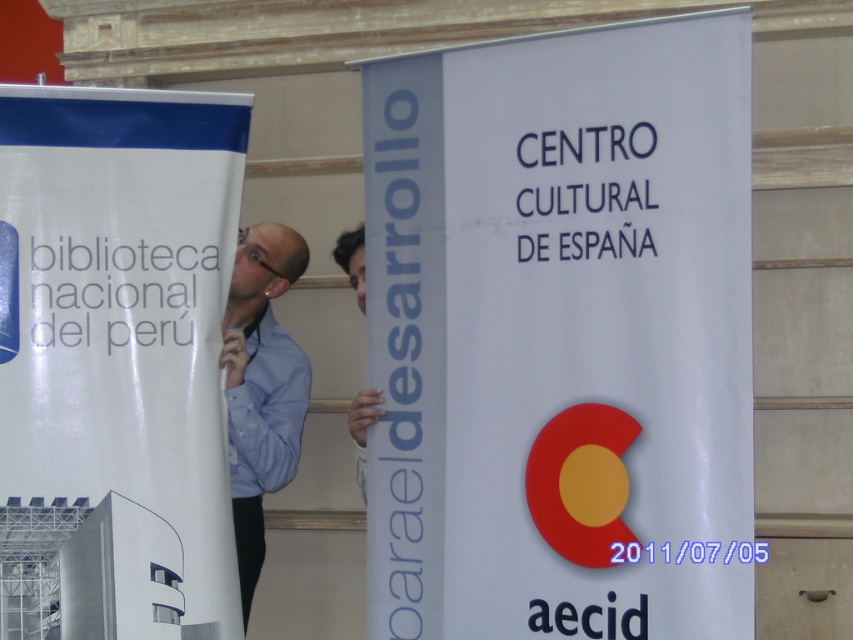
Is white paper banner at center positioned behind blue shirt at left?

No, it is in front of blue shirt at left.

Who is shorter, white paper banner at center or blue shirt at left?

With less height is blue shirt at left.

Does point (515, 96) come closer to viewer compared to point (244, 444)?

Yes.

Where is `white paper banner at center`? white paper banner at center is located at coordinates tap(561, 336).

Who is more forward, [694,392] or [262,337]?

Positioned in front is point [694,392].

The width and height of the screenshot is (853, 640). Describe the element at coordinates (561, 336) in the screenshot. I see `white paper banner at center` at that location.

The width and height of the screenshot is (853, 640). In order to click on white paper banner at center in this screenshot , I will do 561,336.

Image resolution: width=853 pixels, height=640 pixels. Describe the element at coordinates (260, 387) in the screenshot. I see `blue shirt at left` at that location.

Is blue shirt at left below matte blue shirt at center?

Yes, blue shirt at left is below matte blue shirt at center.

Find the location of a particular element. The image size is (853, 640). blue shirt at left is located at coordinates (260, 387).